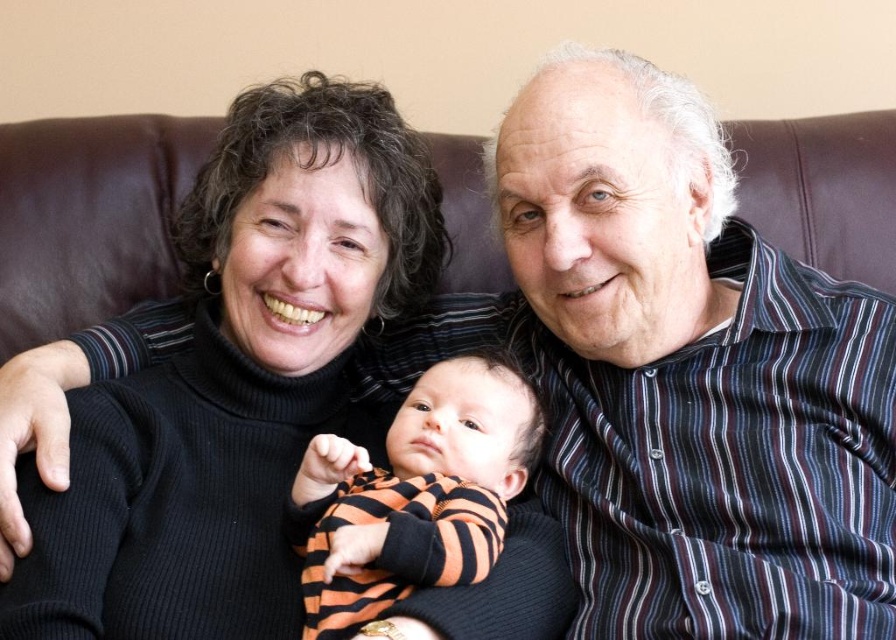
Question: Can you confirm if striped shirt at upper right is positioned below black turtleneck sweater at center?

Choices:
 (A) yes
 (B) no

Answer: (B)

Question: Which of the following is the closest to the observer?

Choices:
 (A) striped shirt at upper right
 (B) black turtleneck sweater at center
 (C) orange striped onesie at center

Answer: (B)

Question: Which object is positioned farthest from the orange striped onesie at center?

Choices:
 (A) black turtleneck sweater at center
 (B) striped shirt at upper right

Answer: (B)

Question: Is black turtleneck sweater at center to the right of orange striped onesie at center from the viewer's perspective?

Choices:
 (A) no
 (B) yes

Answer: (A)

Question: Among these points, which one is nearest to the camera?

Choices:
 (A) (110, 612)
 (B) (765, 435)

Answer: (A)

Question: Is black turtleneck sweater at center bigger than orange striped onesie at center?

Choices:
 (A) yes
 (B) no

Answer: (A)